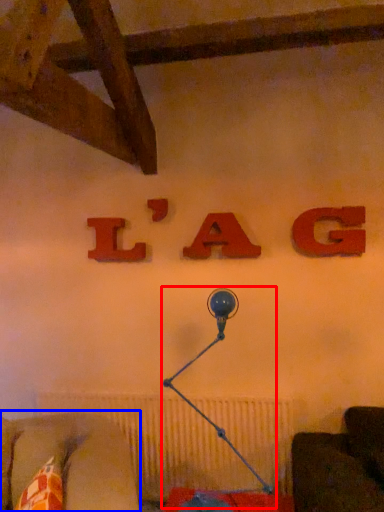
Question: Among these objects, which one is nearest to the camera, table lamp (highlighted by a red box) or furniture (highlighted by a blue box)?

Choices:
 (A) table lamp
 (B) furniture

Answer: (B)